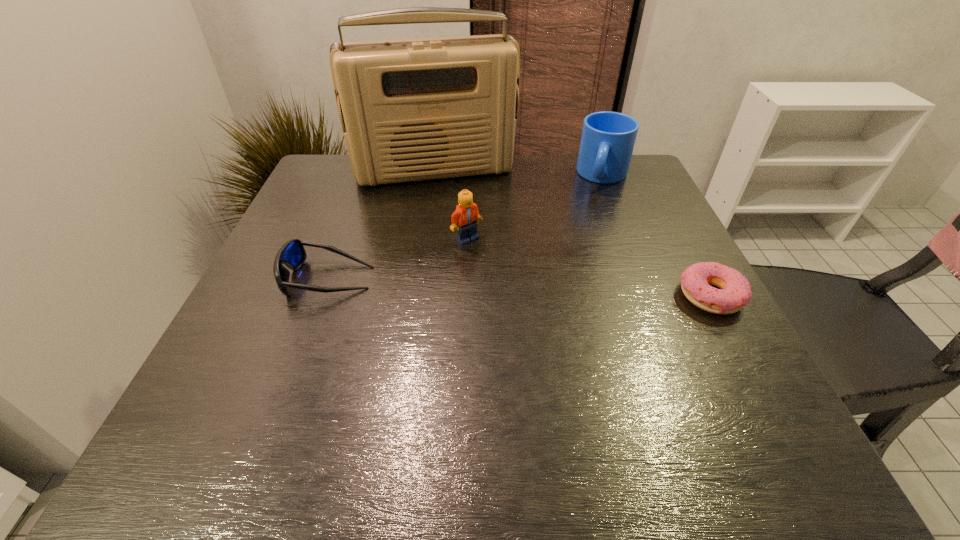
Locate an element on the screen. The height and width of the screenshot is (540, 960). sunglasses is located at coordinates (292, 254).

Identify the location of doughnut. The width and height of the screenshot is (960, 540). (735, 292).

Locate an element on the screen. radio receiver is located at coordinates (419, 109).

Locate an element on the screen. mug is located at coordinates (x=608, y=138).

At what (x,y) coordinates should I click in order to perform the action: click on Lego. Please return your answer as a coordinate pair (x, y). Looking at the image, I should click on (465, 218).

Image resolution: width=960 pixels, height=540 pixels. In order to click on vacant space located on the left of the doughnut in this screenshot , I will do `click(571, 296)`.

You are a GUI agent. You are given a task and a screenshot of the screen. Output one action in this format:
    pyautogui.click(x=<x>, y=<y>)
    Task: Click on the free space located on the front-facing side of the radio receiver
    Image resolution: width=960 pixels, height=540 pixels.
    Given the screenshot: What is the action you would take?
    pyautogui.click(x=467, y=256)

Where is `blank area located on the front-facing side of the radio receiver`? The height and width of the screenshot is (540, 960). blank area located on the front-facing side of the radio receiver is located at coordinates (469, 265).

At what (x,y) coordinates should I click in order to perform the action: click on vacant space located on the front-facing side of the radio receiver. Please return your answer as a coordinate pair (x, y). This screenshot has height=540, width=960. Looking at the image, I should click on (455, 214).

What are the coordinates of `vacant space situated on the side of the mug with the handle` in the screenshot? It's located at (596, 212).